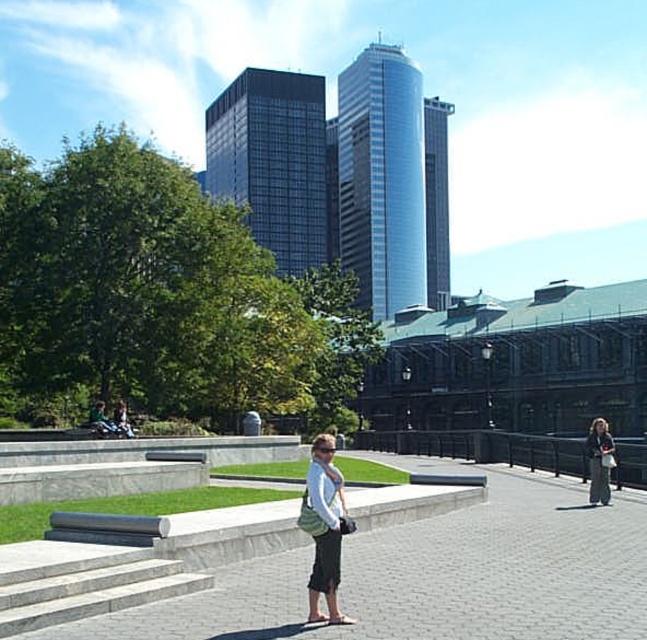
Question: Where is green fabric bag at center located in relation to gray fabric pants at right in the image?

Choices:
 (A) below
 (B) above

Answer: (B)

Question: Can you confirm if gray concrete stairs at lower left is positioned to the left of green fabric bag at center?

Choices:
 (A) no
 (B) yes

Answer: (B)

Question: Is gray concrete stairs at lower left in front of gray fabric pants at right?

Choices:
 (A) no
 (B) yes

Answer: (B)

Question: Which object appears farthest from the camera in this image?

Choices:
 (A) gray concrete stairs at lower left
 (B) gray fabric pants at right
 (C) green fabric bag at center

Answer: (B)

Question: Among these objects, which one is nearest to the camera?

Choices:
 (A) gray concrete stairs at lower left
 (B) green fabric bag at center
 (C) gray fabric pants at right

Answer: (B)

Question: Among these objects, which one is farthest from the camera?

Choices:
 (A) gray concrete stairs at lower left
 (B) gray fabric pants at right

Answer: (B)